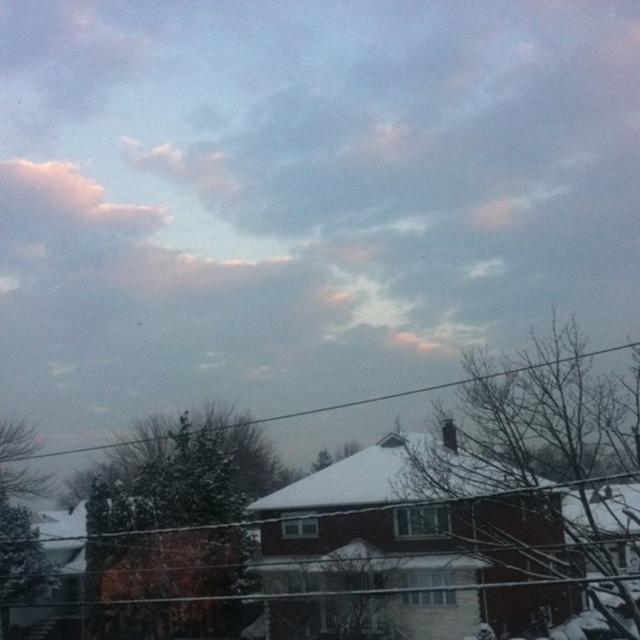
Question: Among these points, which one is farthest from the camera?

Choices:
 (A) (20, 189)
 (B) (461, 381)

Answer: (A)

Question: Can you confirm if puffy white cloud at upper left is positioned above black wire at upper center?

Choices:
 (A) yes
 (B) no

Answer: (A)

Question: Which point is farther to the camera?

Choices:
 (A) (36, 216)
 (B) (355, 404)

Answer: (A)

Question: Can you confirm if puffy white cloud at upper left is positioned below black wire at upper center?

Choices:
 (A) no
 (B) yes

Answer: (A)

Question: Which of the following is the farthest from the observer?

Choices:
 (A) (108, 445)
 (B) (90, 225)

Answer: (B)

Question: Does puffy white cloud at upper left appear under black wire at upper center?

Choices:
 (A) yes
 (B) no

Answer: (B)